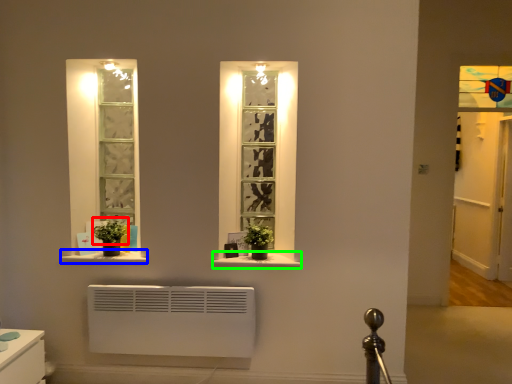
Question: Estimate the real-world distances between objects in this image. Which object is closer to plant (highlighted by a red box), window sill (highlighted by a blue box) or window sill (highlighted by a green box)?

Choices:
 (A) window sill
 (B) window sill

Answer: (A)